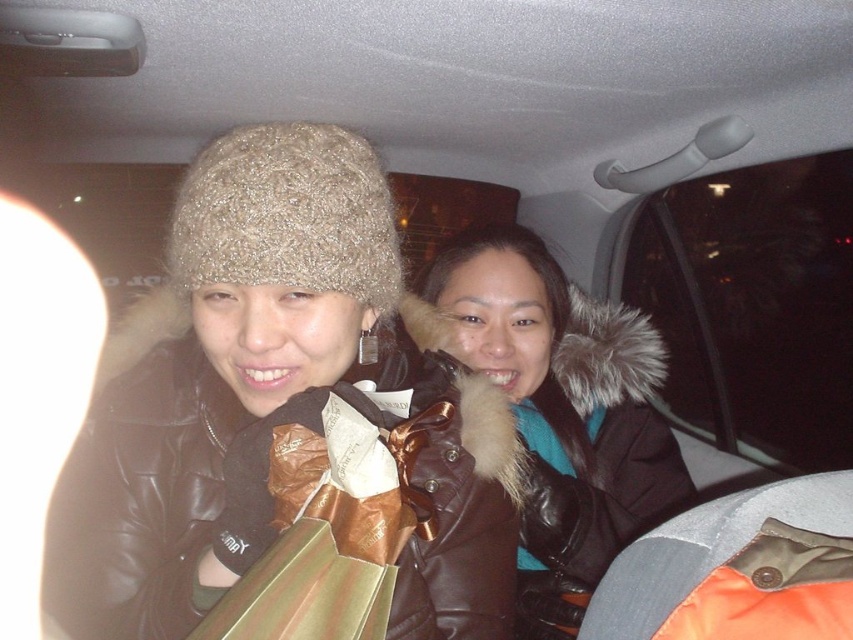
Who is more forward, (473, 300) or (337, 189)?

Positioned in front is point (337, 189).

How far apart are brown leather jacket at center and knitted beige hat at upper left?

They are 29.74 inches apart.

Does point (541, 308) come in front of point (236, 170)?

No, it is behind (236, 170).

At what (x,y) coordinates should I click in order to perform the action: click on brown leather jacket at center. Please return your answer as a coordinate pair (x, y). This screenshot has height=640, width=853. Looking at the image, I should click on (564, 412).

Looking at this image, between knitted woolen hat at upper left and knitted beige hat at upper left, which one appears on the right side from the viewer's perspective?

From the viewer's perspective, knitted beige hat at upper left appears more on the right side.

Can you confirm if knitted woolen hat at upper left is taller than knitted beige hat at upper left?

Yes, knitted woolen hat at upper left is taller than knitted beige hat at upper left.

Find the location of `knitted woolen hat at upper left`. knitted woolen hat at upper left is located at coordinates (271, 400).

Which is more to the left, knitted woolen hat at upper left or brown leather jacket at center?

From the viewer's perspective, knitted woolen hat at upper left appears more on the left side.

The image size is (853, 640). What do you see at coordinates (271, 400) in the screenshot?
I see `knitted woolen hat at upper left` at bounding box center [271, 400].

Identify the location of knitted woolen hat at upper left. (271, 400).